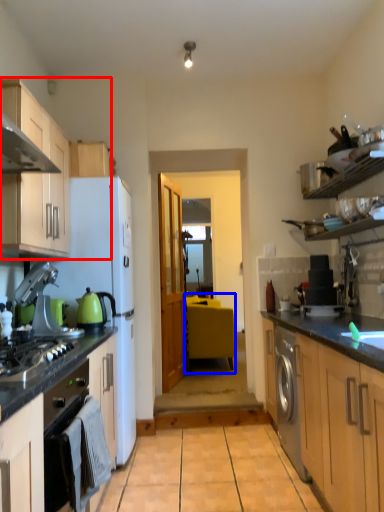
Question: Which object appears closest to the camera in this image, cabinetry (highlighted by a red box) or table (highlighted by a blue box)?

Choices:
 (A) cabinetry
 (B) table

Answer: (A)